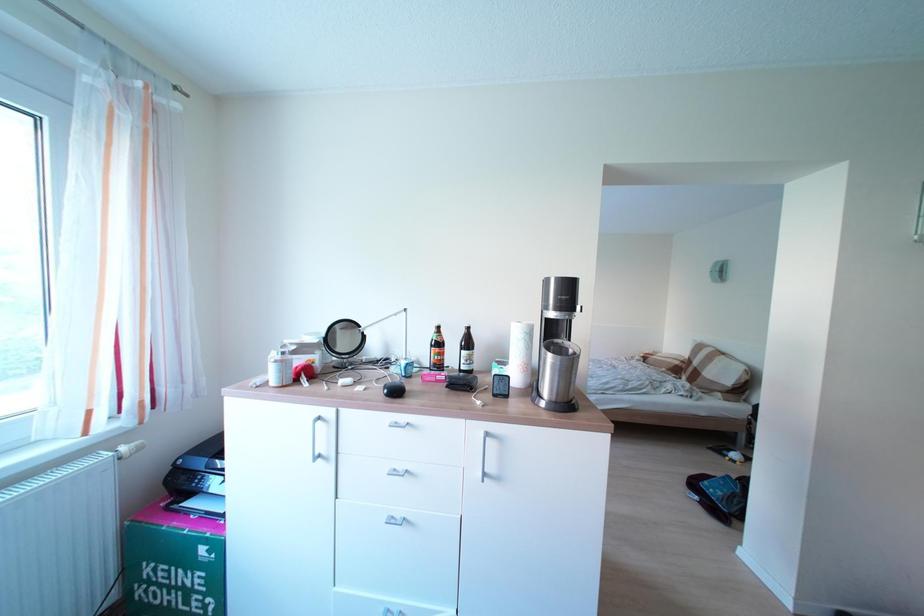
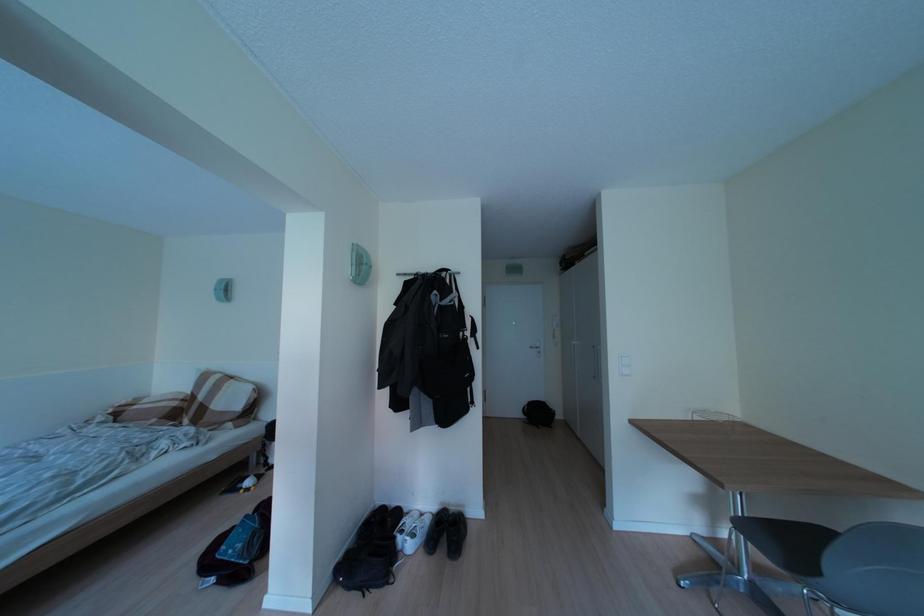
Question: The first image is from the beginning of the video and the second image is from the end. How did the camera likely rotate when shooting the video?

Choices:
 (A) Left
 (B) Right
 (C) Up
 (D) Down

Answer: (B)